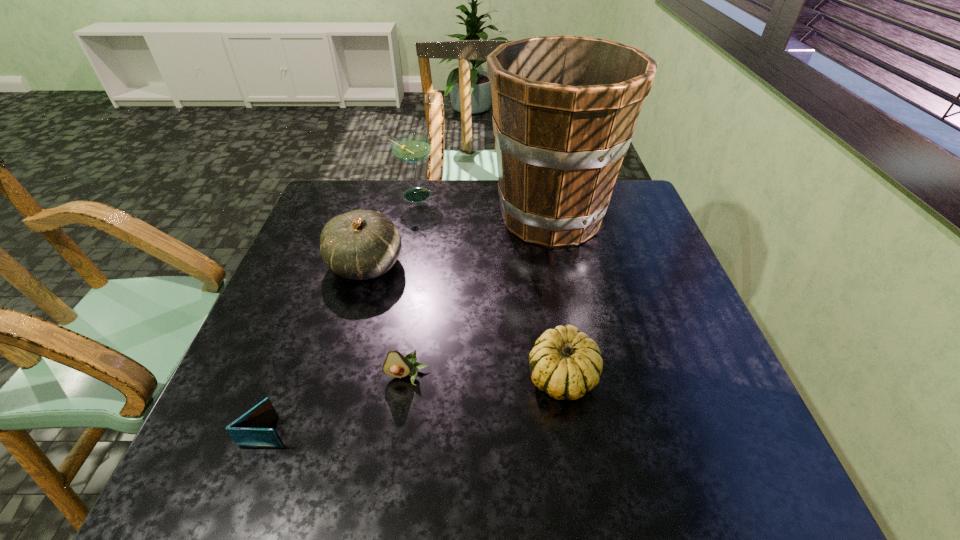
Find the location of a particular element. This screenshot has width=960, height=540. object that is at the right edge is located at coordinates (565, 108).

You are a GUI agent. You are given a task and a screenshot of the screen. Output one action in this format:
    pyautogui.click(x=<x>, y=<y>)
    Task: Click on the object that is at the near left corner
    
    Given the screenshot: What is the action you would take?
    pyautogui.click(x=250, y=430)

You are a GUI agent. You are given a task and a screenshot of the screen. Output one action in this format:
    pyautogui.click(x=<x>, y=<y>)
    Task: Click on the object situated at the far right corner
    Image resolution: width=960 pixels, height=540 pixels.
    Given the screenshot: What is the action you would take?
    pyautogui.click(x=565, y=108)

Where is `vacant region at the far edge`? The image size is (960, 540). vacant region at the far edge is located at coordinates (376, 189).

In the image, there is a desktop. Find the location of `vacant space at the near edge`. vacant space at the near edge is located at coordinates (396, 458).

This screenshot has width=960, height=540. What are the coordinates of `free space at the left edge of the desktop` in the screenshot? It's located at (246, 359).

Where is `free region at the right edge of the desktop`? The height and width of the screenshot is (540, 960). free region at the right edge of the desktop is located at coordinates (624, 281).

Where is `free location at the far left corner`? This screenshot has height=540, width=960. free location at the far left corner is located at coordinates (371, 200).

Where is `vacant space at the far right corner`? vacant space at the far right corner is located at coordinates (626, 186).

The height and width of the screenshot is (540, 960). What are the coordinates of `free space that is in between the shortest object and the left gourd` in the screenshot? It's located at (317, 348).